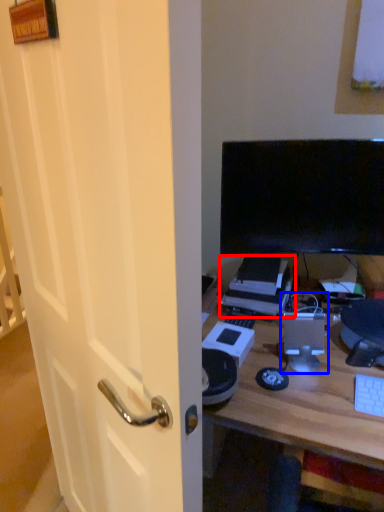
Question: Which of the following is the farthest to the observer, printer (highlighted by a red box) or computer tower (highlighted by a blue box)?

Choices:
 (A) printer
 (B) computer tower

Answer: (A)